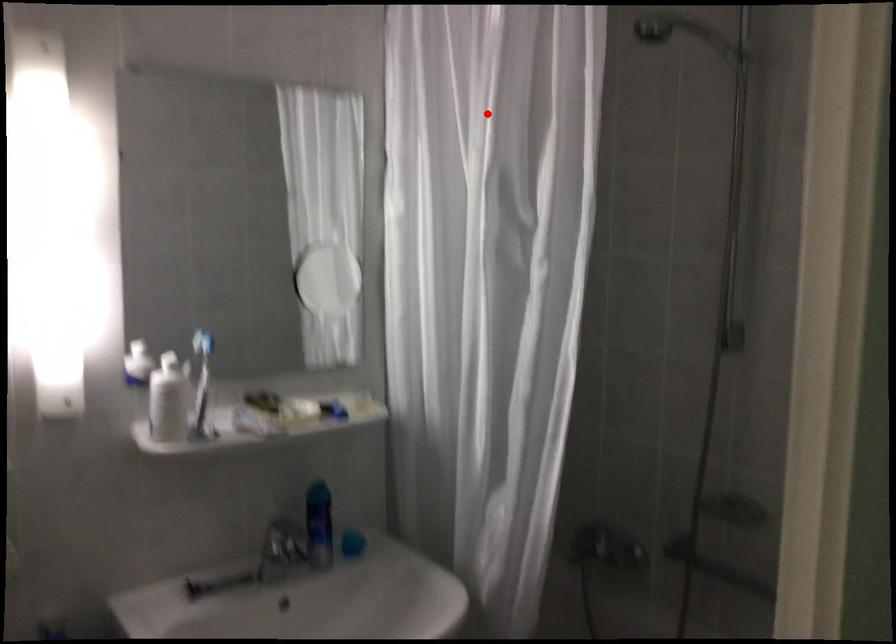
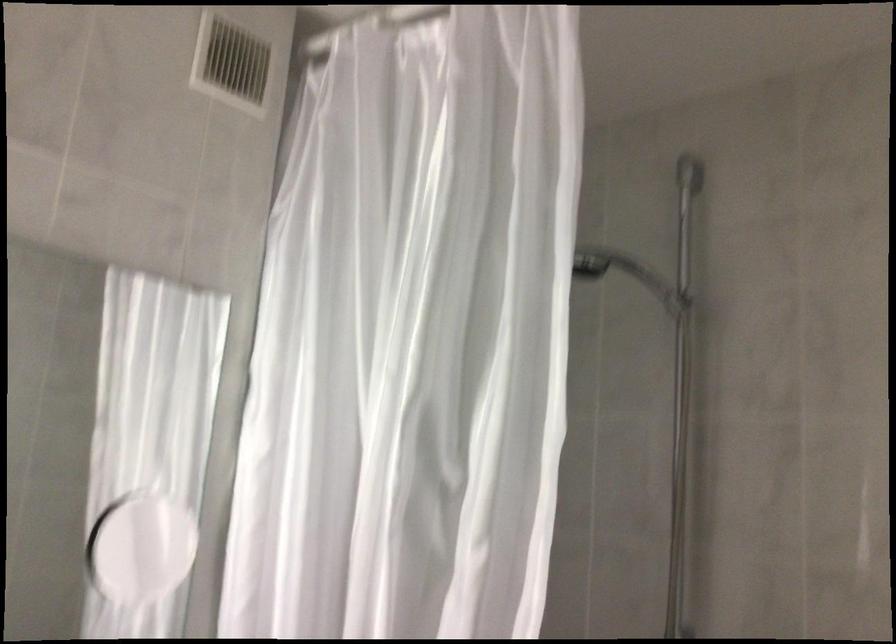
Find the pixel in the second image that matches the highlighted location in the first image.

(412, 337)